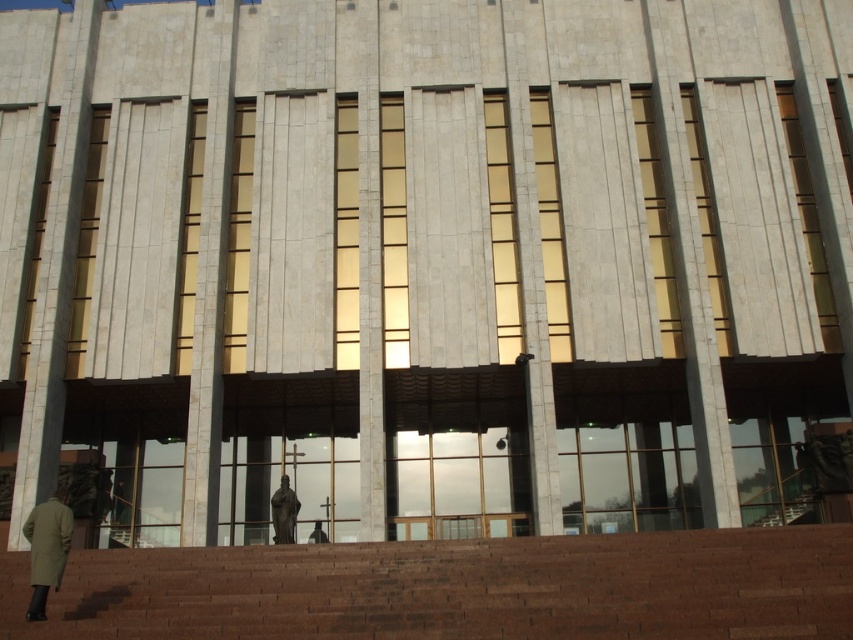
You are standing at the bottom of the brown brick stairs at lower left and want to reach the dark gray fabric person at center. How does the size of the stairs compare to the person?

The brown brick stairs at lower left is bigger than the dark gray fabric person at center.